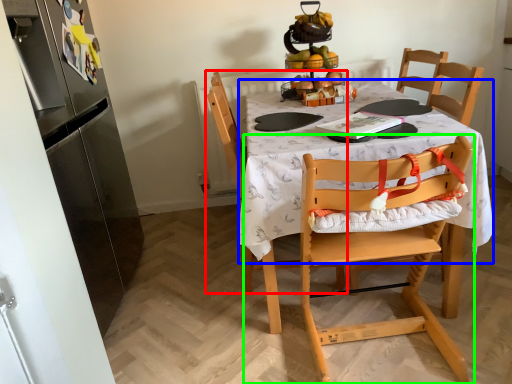
Question: Considering the real-world distances, which object is closest to chair (highlighted by a red box)? round table (highlighted by a blue box) or chair (highlighted by a green box).

Choices:
 (A) round table
 (B) chair

Answer: (A)